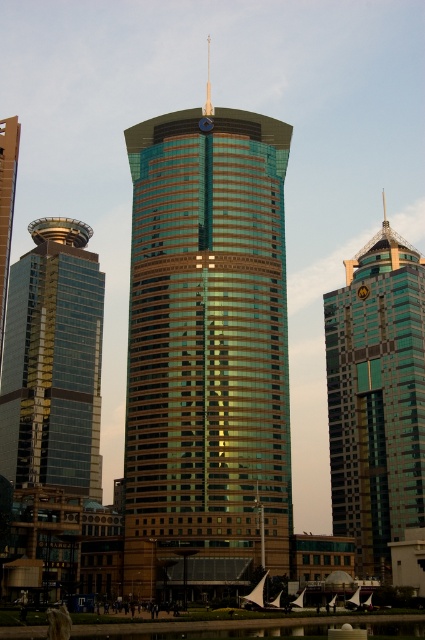
The width and height of the screenshot is (425, 640). Identify the location of green glassy tower at center. [206, 353].

Identify the location of green glassy tower at center. The width and height of the screenshot is (425, 640). (206, 353).

Does green glassy tower at center have a lesser width compared to shiny glass skyscraper at left?

In fact, green glassy tower at center might be wider than shiny glass skyscraper at left.

In the scene shown: Does green glassy tower at center come in front of shiny glass skyscraper at left?

Yes, it is in front of shiny glass skyscraper at left.

This screenshot has height=640, width=425. Find the location of `green glassy tower at center`. green glassy tower at center is located at coordinates (206, 353).

Image resolution: width=425 pixels, height=640 pixels. Identify the location of green glassy tower at center. (206, 353).

Does green glass skyscraper at upper right lie behind shiny glass skyscraper at left?

That is False.

From the picture: Between green glass skyscraper at upper right and shiny glass skyscraper at left, which one appears on the left side from the viewer's perspective?

Positioned to the left is shiny glass skyscraper at left.

Which is behind, point (365, 285) or point (78, 257)?

The point (78, 257) is more distant.

Locate an element on the screen. This screenshot has height=640, width=425. green glass skyscraper at upper right is located at coordinates (376, 397).